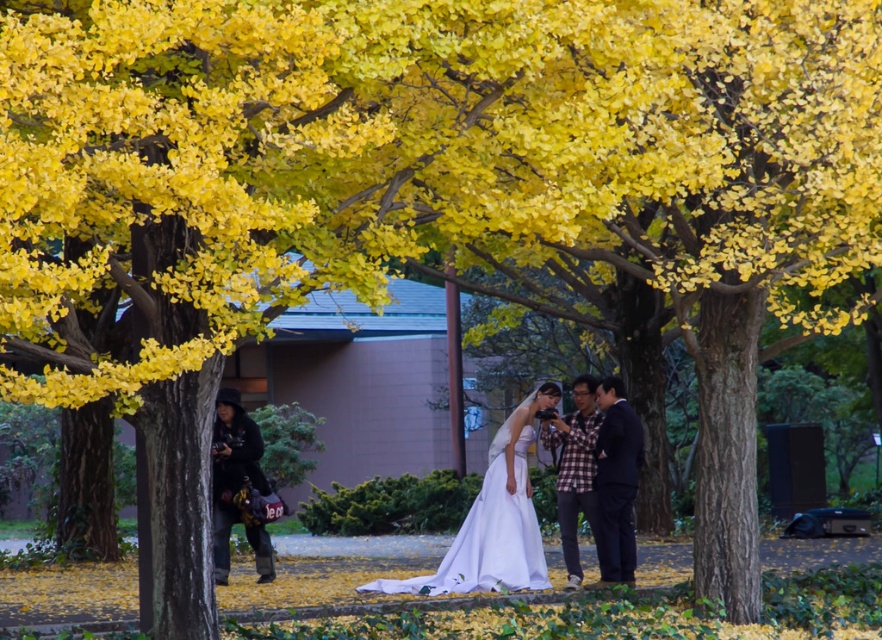
You are a photographer at the autumn wedding. You see the yellow leafy tree at center and the dark blue suit at center. Which object is taller?

The yellow leafy tree at center is taller than the dark blue suit at center.

In the autumn scene with the yellow leafy tree at center and the dark blue suit at center, which object takes up more space in the image?

The yellow leafy tree at center is larger in size than the dark blue suit at center, so it takes up more space in the image.